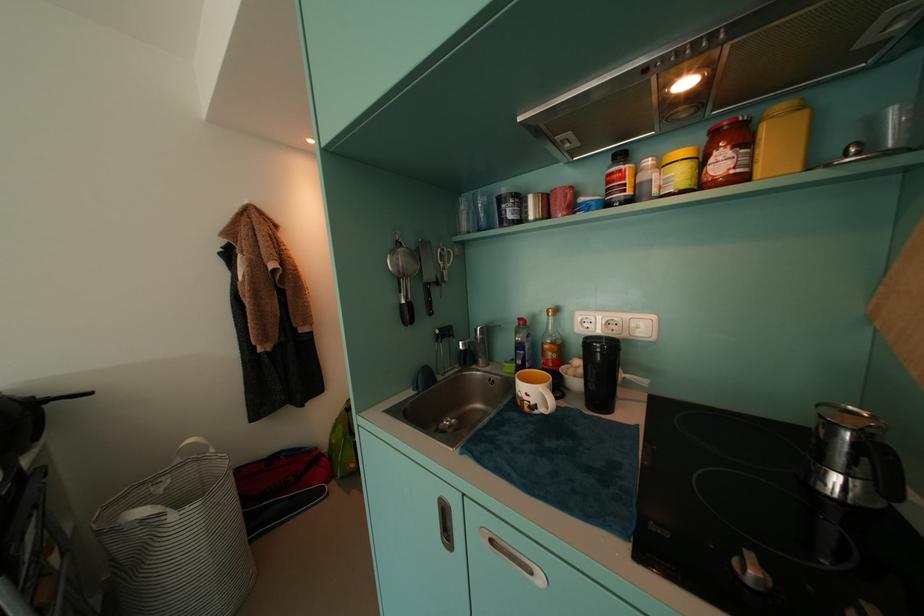
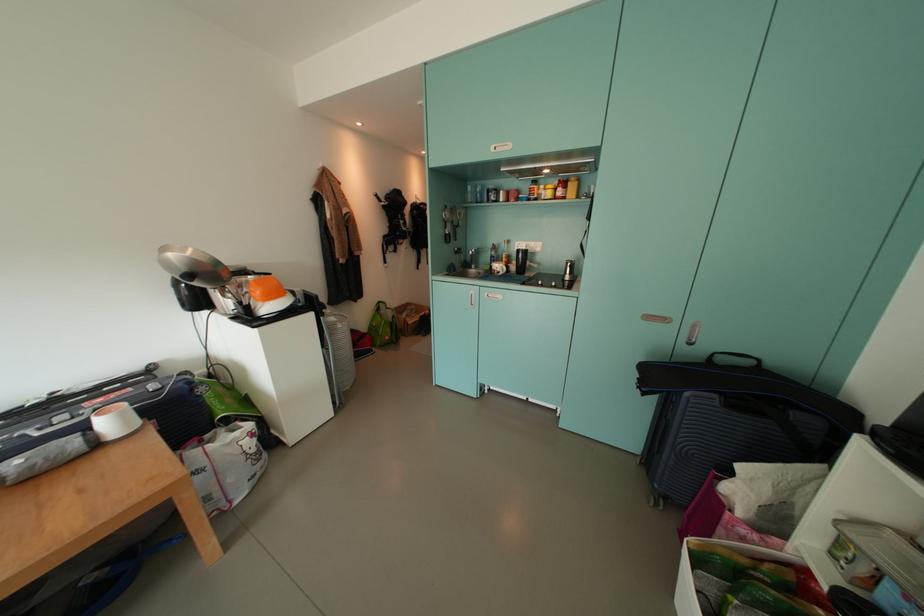
Locate, in the second image, the point that corresponds to (730,166) in the first image.

(566, 195)